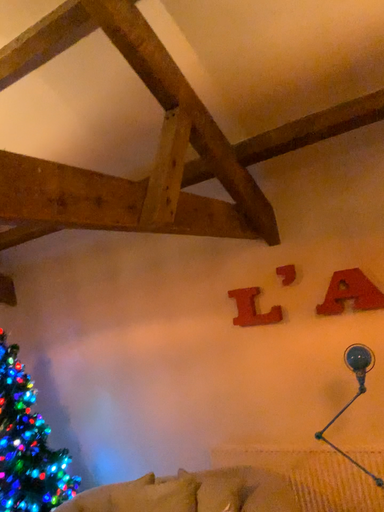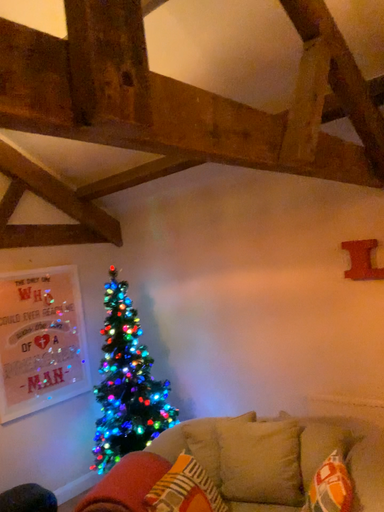
Question: How did the camera likely rotate when shooting the video?

Choices:
 (A) rotated right
 (B) rotated left

Answer: (B)